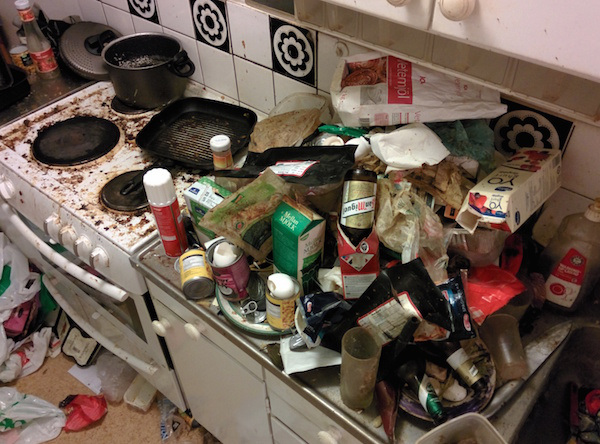
Identify the location of cabinet door. The image size is (600, 444). coord(184,373).